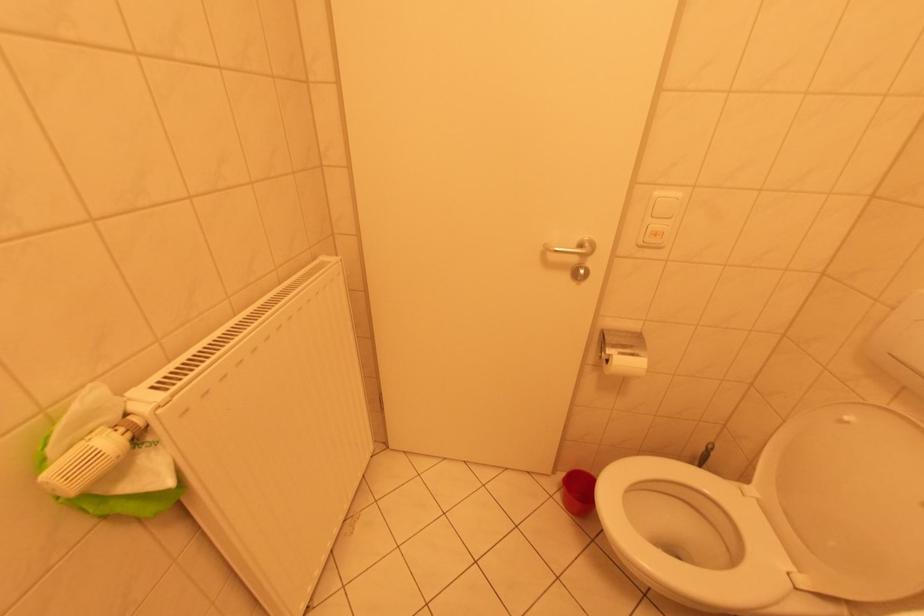
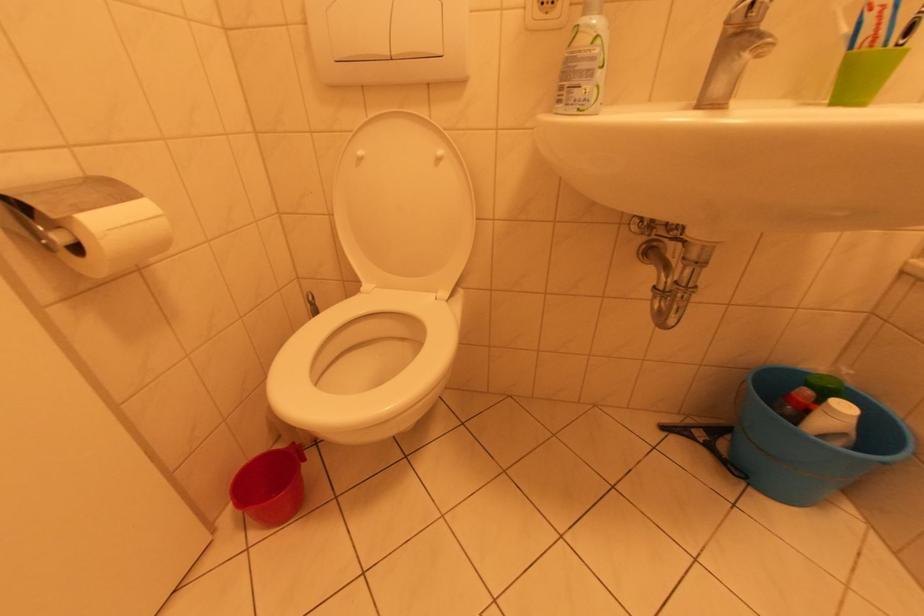
Based on the continuous images, in which direction is the camera rotating?

The camera rotated toward right-down.